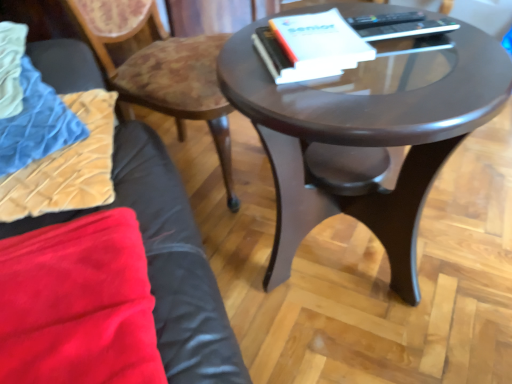
In the scene shown: Measure the distance between glossy dark wood coffee table at center and camera.

glossy dark wood coffee table at center is 66.88 centimeters away from camera.

What is the approximate height of wooden textured chair at upper left?

wooden textured chair at upper left is 26.48 inches in height.

Describe the element at coordinates (161, 69) in the screenshot. The width and height of the screenshot is (512, 384). I see `wooden textured chair at upper left` at that location.

Find the location of a particular element. Image resolution: width=512 pixels, height=384 pixels. velvet blue blanket at left is located at coordinates (36, 124).

From the image's perspective, is velvet blue blanket at left located beneath white paper at center?

Indeed, from the image's perspective, velvet blue blanket at left is shown beneath white paper at center.

Is velvet blue blanket at left far from white paper at center?

No, velvet blue blanket at left is in close proximity to white paper at center.

Considering the sizes of velvet blue blanket at left and white paper at center in the image, is velvet blue blanket at left wider or thinner than white paper at center?

Clearly, velvet blue blanket at left has more width compared to white paper at center.

Which is correct: velvet blue blanket at left is inside white paper at center, or outside of it?

velvet blue blanket at left is not inside white paper at center, it's outside.

In terms of width, does glossy dark wood coffee table at center look wider or thinner when compared to velvet blue blanket at left?

Clearly, glossy dark wood coffee table at center has more width compared to velvet blue blanket at left.

Which is in front, glossy dark wood coffee table at center or velvet blue blanket at left?

glossy dark wood coffee table at center.

What's the angular difference between glossy dark wood coffee table at center and velvet blue blanket at left's facing directions?

glossy dark wood coffee table at center and velvet blue blanket at left are facing 19.4 degrees away from each other.

Locate an element on the screen. coffee table below the velvet blue blanket at left (from a real-world perspective) is located at coordinates tap(364, 140).

Does white paper at center have a lesser height compared to velvet beige pillow at lower left?

Yes.

From a real-world perspective, is white paper at center on top of velvet beige pillow at lower left?

Yes, from a real-world perspective, white paper at center is on top of velvet beige pillow at lower left.

In terms of width, does white paper at center look wider or thinner when compared to velvet beige pillow at lower left?

Considering their sizes, white paper at center looks slimmer than velvet beige pillow at lower left.

Is white paper at center in front of velvet beige pillow at lower left?

No, the depth of white paper at center is greater than that of velvet beige pillow at lower left.

Find the location of `chair that is under the white paper at center (from a real-world perspective)`. chair that is under the white paper at center (from a real-world perspective) is located at coordinates (161, 69).

Based on the photo, which is closer to the camera, (115, 74) or (325, 34)?

Positioned in front is point (325, 34).

How different are the orientations of wooden textured chair at upper left and white paper at center in degrees?

They differ by 31.1 degrees in their facing directions.

Where is `chair that is behind the glossy dark wood coffee table at center`? This screenshot has height=384, width=512. chair that is behind the glossy dark wood coffee table at center is located at coordinates (161, 69).

Would you say wooden textured chair at upper left is outside glossy dark wood coffee table at center?

Yes, wooden textured chair at upper left is not within glossy dark wood coffee table at center.

Which of these two, wooden textured chair at upper left or glossy dark wood coffee table at center, is thinner?

wooden textured chair at upper left is thinner.

Between wooden textured chair at upper left and glossy dark wood coffee table at center, which one has less height?

glossy dark wood coffee table at center is shorter.

Is glossy dark wood coffee table at center directly adjacent to white paper at center?

No, glossy dark wood coffee table at center is not touching white paper at center.

Between glossy dark wood coffee table at center and white paper at center, which one has larger width?

glossy dark wood coffee table at center is wider.

Which object is more forward, glossy dark wood coffee table at center or white paper at center?

Positioned in front is glossy dark wood coffee table at center.

From the image's perspective, is wooden textured chair at upper left below velvet blue blanket at left?

Incorrect, from the image's perspective, wooden textured chair at upper left is higher than velvet blue blanket at left.

From a real-world perspective, does wooden textured chair at upper left stand above velvet blue blanket at left?

No, from a real-world perspective, wooden textured chair at upper left is not on top of velvet blue blanket at left.

Looking at their sizes, would you say wooden textured chair at upper left is wider or thinner than velvet blue blanket at left?

wooden textured chair at upper left is wider than velvet blue blanket at left.

Is wooden textured chair at upper left smaller than velvet blue blanket at left?

No.

Locate an element on the screen. The width and height of the screenshot is (512, 384). paperback book that appears behind the velvet blue blanket at left is located at coordinates (310, 46).

The image size is (512, 384). There is a glossy dark wood coffee table at center. What are the coordinates of `blanket above it (from a real-world perspective)` in the screenshot? It's located at (36, 124).

From the image, which object appears to be nearer to white paper at center, wooden textured chair at upper left or glossy dark wood coffee table at center?

Based on the image, glossy dark wood coffee table at center appears to be nearer to white paper at center.

From the image, which object appears to be farther from velvet blue blanket at left, velvet beige pillow at lower left or white paper at center?

white paper at center is further to velvet blue blanket at left.

Considering their positions, is glossy dark wood coffee table at center positioned further to velvet beige pillow at lower left than wooden textured chair at upper left?

glossy dark wood coffee table at center is further to velvet beige pillow at lower left.

Based on their spatial positions, is wooden textured chair at upper left or glossy dark wood coffee table at center closer to velvet blue blanket at left?

wooden textured chair at upper left is positioned closer to the anchor velvet blue blanket at left.

Consider the image. Estimate the real-world distances between objects in this image. Which object is further from glossy dark wood coffee table at center, white paper at center or wooden textured chair at upper left?

Based on the image, wooden textured chair at upper left appears to be further to glossy dark wood coffee table at center.

Which object lies nearer to the anchor point velvet beige pillow at lower left, glossy dark wood coffee table at center or velvet blue blanket at left?

Among the two, velvet blue blanket at left is located nearer to velvet beige pillow at lower left.

Considering their positions, is velvet blue blanket at left positioned closer to wooden textured chair at upper left than white paper at center?

The object closer to wooden textured chair at upper left is velvet blue blanket at left.

Considering their positions, is white paper at center positioned closer to glossy dark wood coffee table at center than velvet blue blanket at left?

white paper at center is positioned closer to the anchor glossy dark wood coffee table at center.

I want to click on chair situated between velvet blue blanket at left and glossy dark wood coffee table at center from left to right, so click(161, 69).

What are the coordinates of `paperback book between wooden textured chair at upper left and glossy dark wood coffee table at center in the horizontal direction` in the screenshot? It's located at (310, 46).

Find the location of a particular element. The height and width of the screenshot is (384, 512). pillow located between velvet blue blanket at left and white paper at center in the left-right direction is located at coordinates (67, 166).

Where is `chair situated between velvet blue blanket at left and white paper at center from left to right`? Image resolution: width=512 pixels, height=384 pixels. chair situated between velvet blue blanket at left and white paper at center from left to right is located at coordinates (161, 69).